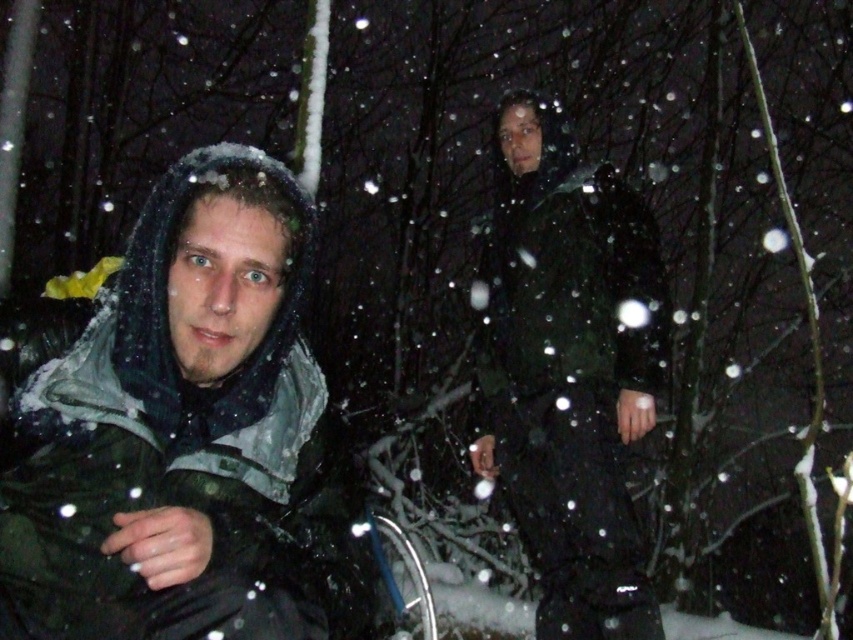
Who is taller, matte black jacket at left or dark green jacket at center?

With more height is dark green jacket at center.

Is point (109, 310) closer to camera compared to point (601, 268)?

Yes, point (109, 310) is closer to viewer.

The width and height of the screenshot is (853, 640). I want to click on matte black jacket at left, so click(189, 436).

Find the location of a particular element. matte black jacket at left is located at coordinates (x=189, y=436).